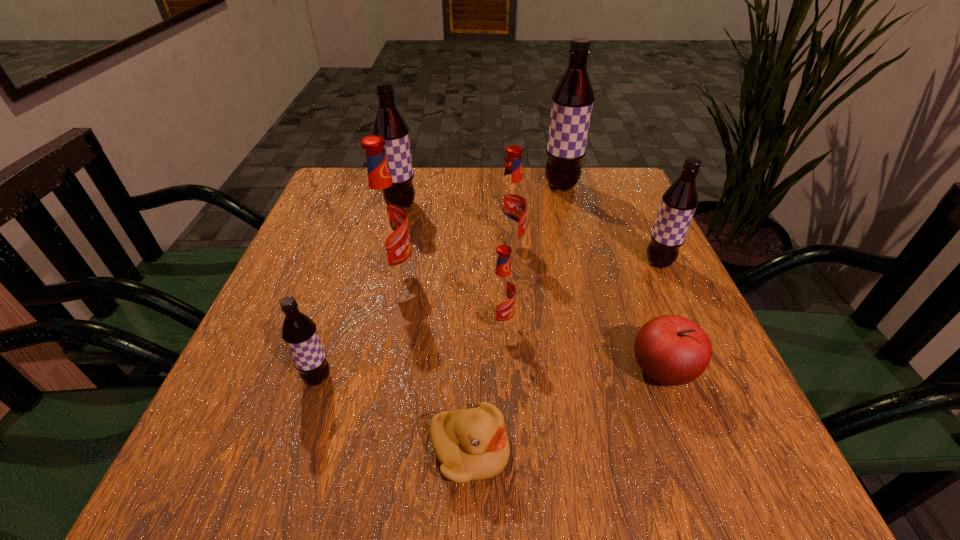
This screenshot has width=960, height=540. I want to click on the fourth nearest object, so click(x=502, y=289).

Where is `the leftmost brown root beer`? the leftmost brown root beer is located at coordinates (299, 332).

Identify the location of the nearest brown root beer. The image size is (960, 540). (299, 332).

This screenshot has width=960, height=540. What are the coordinates of `the second shortest object` in the screenshot? It's located at (672, 350).

At what (x,y) coordinates should I click in order to perform the action: click on apple. Please return your answer as a coordinate pair (x, y). The height and width of the screenshot is (540, 960). Looking at the image, I should click on [x=672, y=350].

Where is `yellow duckling`? This screenshot has width=960, height=540. yellow duckling is located at coordinates (471, 444).

The width and height of the screenshot is (960, 540). In order to click on the shortest object in this screenshot , I will do `click(471, 444)`.

Find the location of `free region located on the left of the sixth root beer from left to right`. free region located on the left of the sixth root beer from left to right is located at coordinates (443, 186).

Locate an element on the screen. vacant space located 0.160m on the front of the biggest red root beer is located at coordinates (378, 351).

Where is `free spot located 0.120m on the front of the third smallest brown root beer`? Image resolution: width=960 pixels, height=540 pixels. free spot located 0.120m on the front of the third smallest brown root beer is located at coordinates (391, 244).